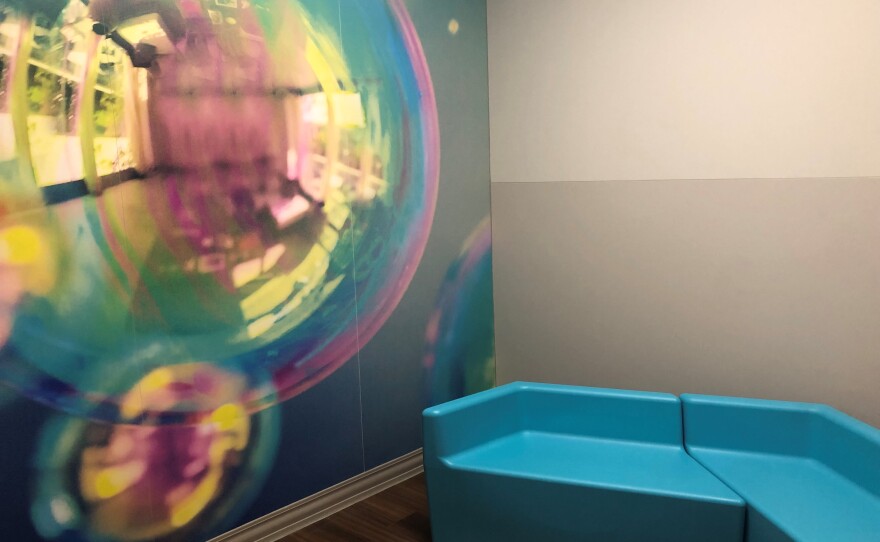
I want to click on plastic seating, so click(589, 451), click(812, 467).